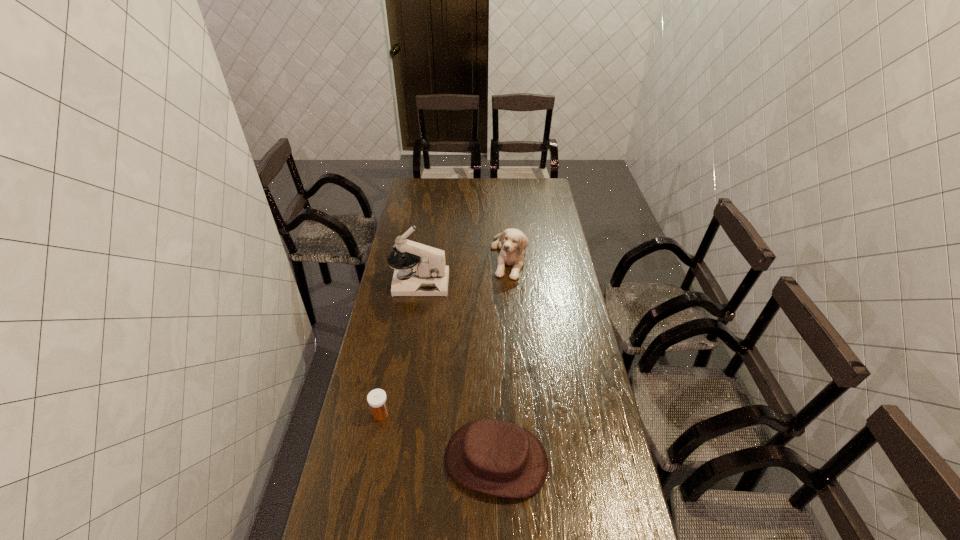
Find the location of a particular element. the tallest object is located at coordinates (429, 276).

Identify the location of the third shortest object. The width and height of the screenshot is (960, 540). (512, 242).

You are a GUI agent. You are given a task and a screenshot of the screen. Output one action in this format:
    pyautogui.click(x=<x>, y=<y>)
    Task: Click on the second shortest object
    
    Given the screenshot: What is the action you would take?
    point(495,457)

Image resolution: width=960 pixels, height=540 pixels. What are the coordinates of `hat` in the screenshot? It's located at (495, 457).

The width and height of the screenshot is (960, 540). Identify the location of the third farthest object. (377, 399).

This screenshot has height=540, width=960. Identify the location of medicine. (377, 399).

Where is `free location located at the eyepiece of the tallest object`? free location located at the eyepiece of the tallest object is located at coordinates (532, 284).

Find the location of a particular element. vacant space located on the front-facing side of the puppy is located at coordinates (512, 291).

You are a GUI agent. You are given a task and a screenshot of the screen. Output one action in this format:
    pyautogui.click(x=<x>, y=<y>)
    Task: Click on the vacant space located on the left of the third tallest object
    This screenshot has width=960, height=540.
    Given the screenshot: What is the action you would take?
    [350, 461]

The width and height of the screenshot is (960, 540). Find the location of `vacant space situated 0.390m on the right of the second nearest object`. vacant space situated 0.390m on the right of the second nearest object is located at coordinates (514, 414).